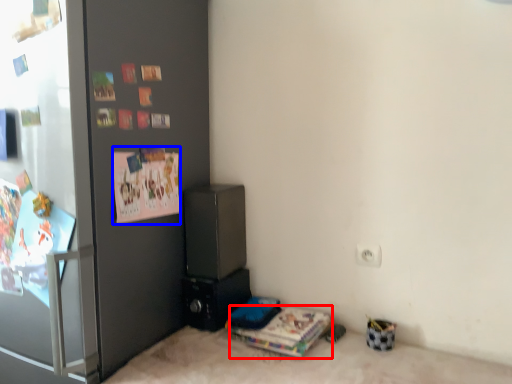
Question: Which point is closer to the camera, magazine (highlighted by a red box) or postcard (highlighted by a blue box)?

Choices:
 (A) magazine
 (B) postcard

Answer: (B)